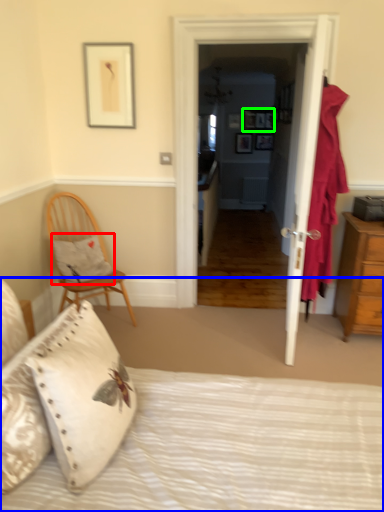
Question: Based on their relative distances, which object is nearer to pillow (highlighted by a red box)? Choose from bed (highlighted by a blue box) and picture frame (highlighted by a green box).

Choices:
 (A) bed
 (B) picture frame

Answer: (A)